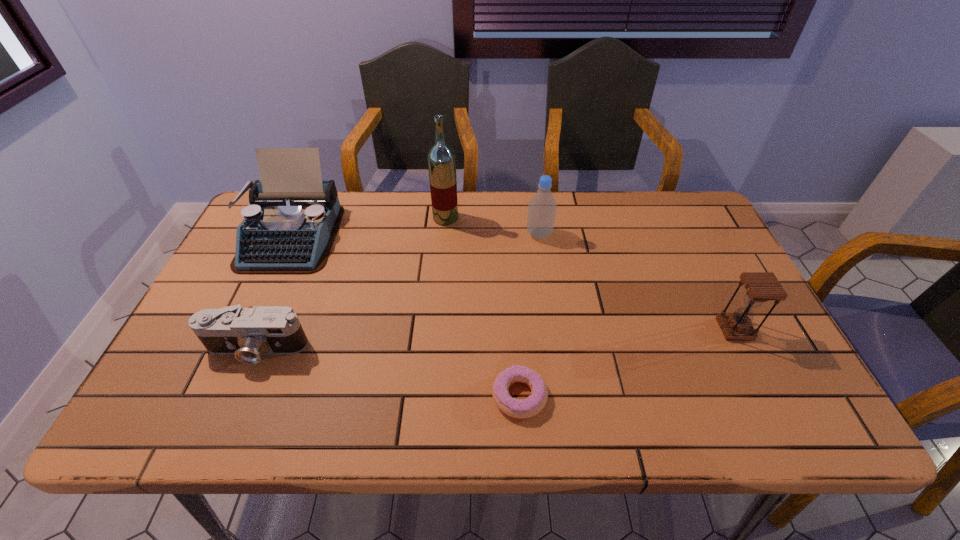
Where is `the third object from left to right`? Image resolution: width=960 pixels, height=540 pixels. the third object from left to right is located at coordinates (441, 158).

In order to click on liquor in this screenshot , I will do `click(441, 158)`.

At what (x,y) coordinates should I click in order to perform the action: click on typewriter. Please return your answer as a coordinate pair (x, y). Image resolution: width=960 pixels, height=540 pixels. Looking at the image, I should click on (289, 227).

This screenshot has height=540, width=960. I want to click on bottle, so click(542, 207).

The height and width of the screenshot is (540, 960). In order to click on the third shortest object in this screenshot , I will do `click(760, 287)`.

Locate an element on the screen. the rightmost object is located at coordinates (760, 287).

Identify the location of the fifth tallest object. (248, 333).

This screenshot has height=540, width=960. Find the location of `the shortest object`. the shortest object is located at coordinates (513, 407).

I want to click on the nearest object, so click(513, 407).

This screenshot has height=540, width=960. What are the coordinates of `vacant position located 0.050m on the left of the tallest object` in the screenshot? It's located at tap(418, 218).